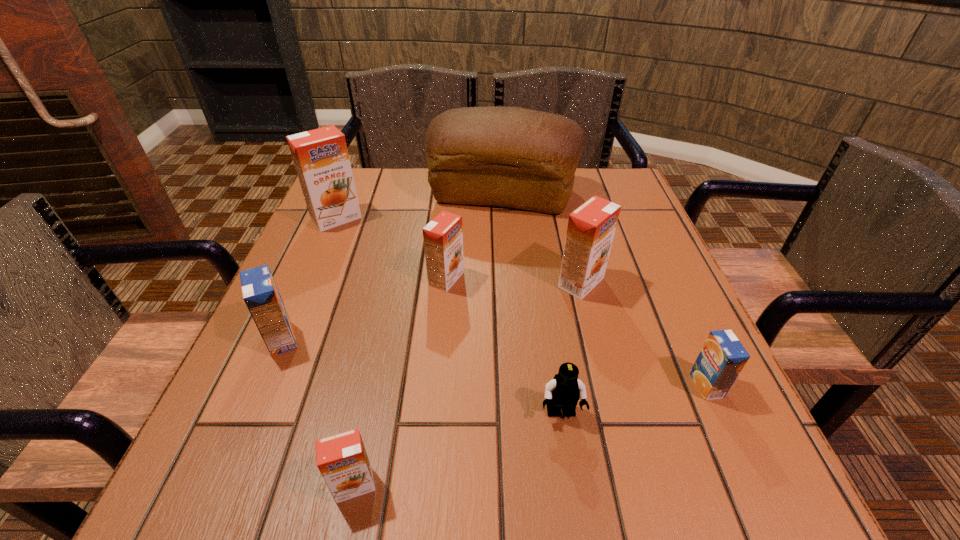
Where is `brown bread`? Image resolution: width=960 pixels, height=540 pixels. brown bread is located at coordinates (513, 157).

Find the location of a particular element. Image resolution: width=960 pixels, height=540 pixels. the tallest orange juice is located at coordinates (321, 159).

The height and width of the screenshot is (540, 960). In order to click on the biggest orange orange juice in this screenshot , I will do `click(321, 159)`.

Where is `the fifth shortest orange juice`? This screenshot has width=960, height=540. the fifth shortest orange juice is located at coordinates (591, 227).

Identify the location of the third smallest orange orange juice. Image resolution: width=960 pixels, height=540 pixels. (591, 227).

The image size is (960, 540). Identify the location of the fourth orange juice from left to right. (443, 236).

This screenshot has height=540, width=960. I want to click on the second orange orange juice from right to left, so click(x=443, y=236).

The image size is (960, 540). Identify the location of the left blue orange_juice. (260, 293).

You are a GUI agent. You are given a task and a screenshot of the screen. Output one action in this format:
    pyautogui.click(x=<x>, y=<y>)
    Task: Click on the fourth nearest object
    The height and width of the screenshot is (540, 960).
    Given the screenshot: What is the action you would take?
    pyautogui.click(x=260, y=293)

You are a GUI agent. You are given a task and a screenshot of the screen. Output one action in this format:
    pyautogui.click(x=<x>, y=<y>)
    Task: Click on the black Lego
    
    Given the screenshot: What is the action you would take?
    pyautogui.click(x=564, y=390)